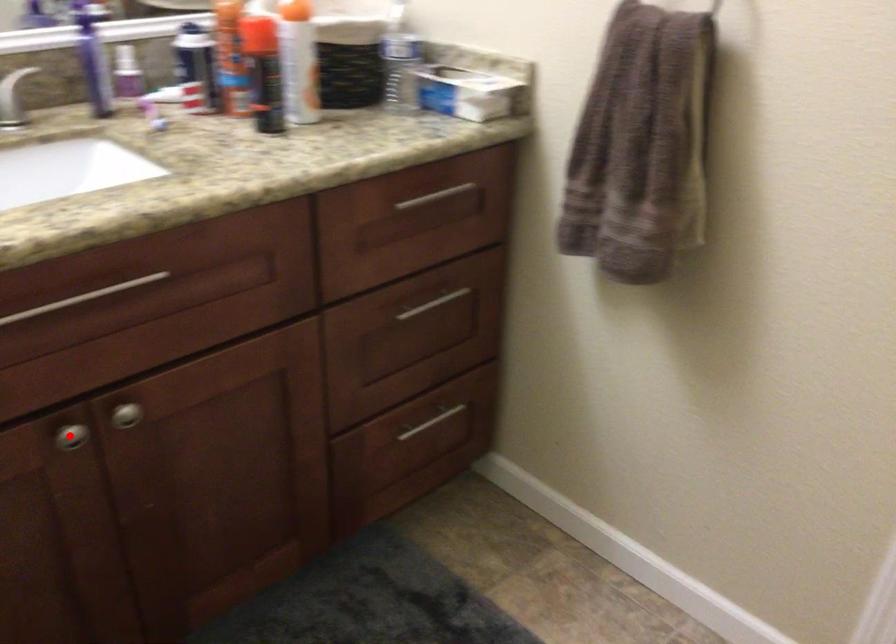
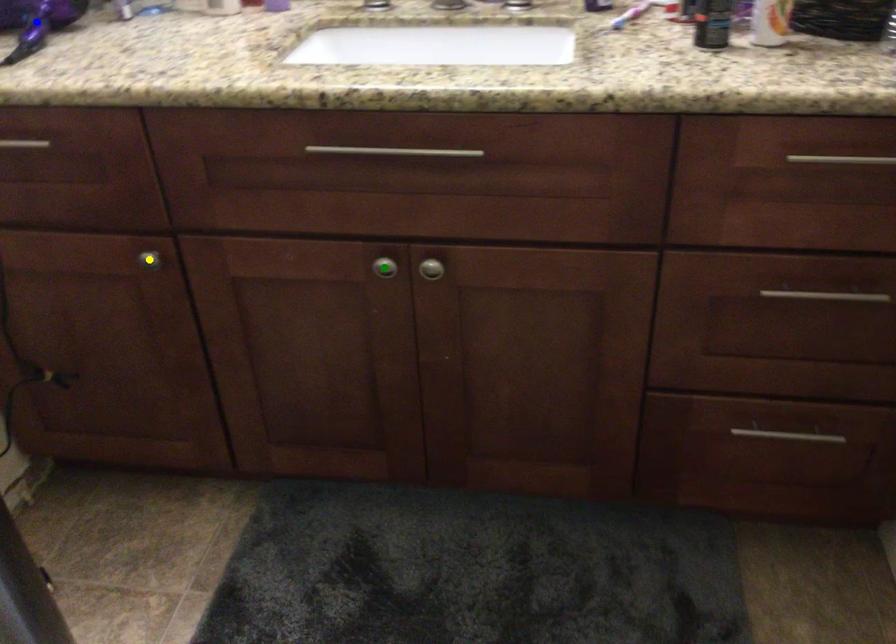
Question: I am providing you with two images of the same scene from different viewpoints. A red point is marked on the first image. You are given multiple points on the second image. Which point in image 2 is actually the same real-world point as the red point in image 1?

Choices:
 (A) green point
 (B) yellow point
 (C) blue point

Answer: (A)